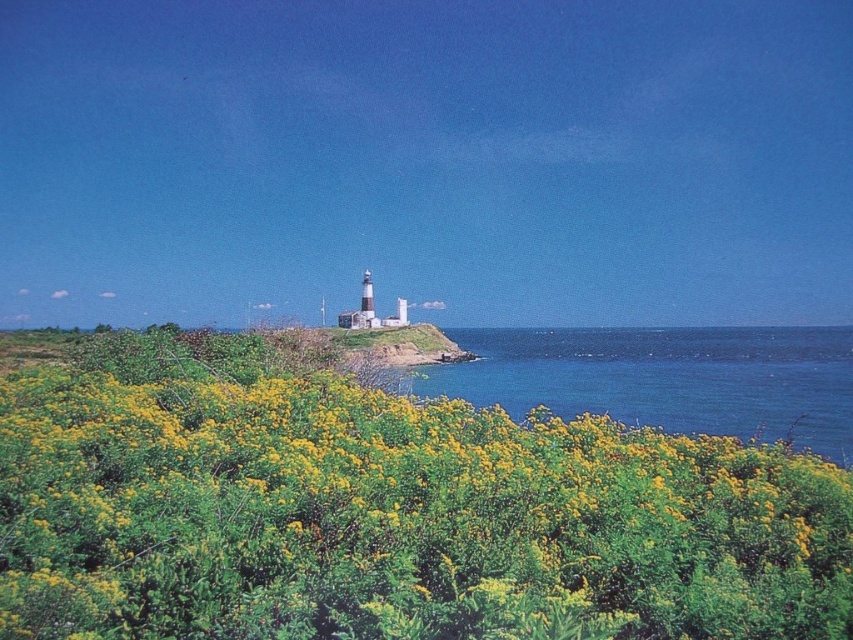
You are standing at the point with coordinates point (194, 509) and want to walk to point (796, 333). Based on the scene description, which direction should you move to get closer to your destination?

You should move away from the camera because point (796, 333) is further from the camera than point (194, 509).

You are a landscape architect designing a new garden. You want to place a decorative fountain in the area where the green leafy shrubs at center and blue liquid water at center are located. Which area should you choose to ensure the fountain fits without overcrowding the space?

The blue liquid water at center area is larger, so placing the fountain there would provide enough space to avoid overcrowding.